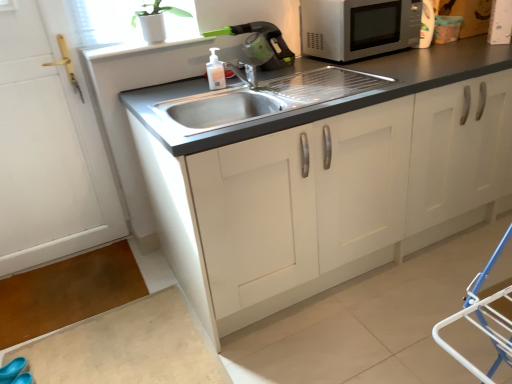
Question: Should I look upward or downward to see stainless steel sink at center?

Choices:
 (A) up
 (B) down

Answer: (A)

Question: Does satin silver microwave at upper right have a lesser width compared to translucent plastic soap dispenser at sink?

Choices:
 (A) no
 (B) yes

Answer: (A)

Question: From the image's perspective, would you say satin silver microwave at upper right is positioned over translucent plastic soap dispenser at sink?

Choices:
 (A) no
 (B) yes

Answer: (B)

Question: Is satin silver microwave at upper right oriented towards translucent plastic soap dispenser at sink?

Choices:
 (A) no
 (B) yes

Answer: (A)

Question: Is satin silver microwave at upper right shorter than translucent plastic soap dispenser at sink?

Choices:
 (A) no
 (B) yes

Answer: (A)

Question: Is satin silver microwave at upper right wider than translucent plastic soap dispenser at sink?

Choices:
 (A) no
 (B) yes

Answer: (B)

Question: From a real-world perspective, is satin silver microwave at upper right located higher than translucent plastic soap dispenser at sink?

Choices:
 (A) no
 (B) yes

Answer: (B)

Question: From the image's perspective, does blue rubber shoe at lower left appear higher than white matte plant pot at upper left?

Choices:
 (A) yes
 (B) no

Answer: (B)

Question: Considering the relative positions of blue rubber shoe at lower left and white matte plant pot at upper left in the image provided, is blue rubber shoe at lower left to the left of white matte plant pot at upper left from the viewer's perspective?

Choices:
 (A) no
 (B) yes

Answer: (B)

Question: Are blue rubber shoe at lower left and white matte plant pot at upper left far apart?

Choices:
 (A) yes
 (B) no

Answer: (A)

Question: Does blue rubber shoe at lower left have a smaller size compared to white matte plant pot at upper left?

Choices:
 (A) no
 (B) yes

Answer: (B)

Question: Considering the relative sizes of blue rubber shoe at lower left and white matte plant pot at upper left in the image provided, is blue rubber shoe at lower left thinner than white matte plant pot at upper left?

Choices:
 (A) yes
 (B) no

Answer: (A)

Question: Is blue rubber shoe at lower left wider than white matte plant pot at upper left?

Choices:
 (A) yes
 (B) no

Answer: (B)

Question: Is satin silver microwave at upper right oriented away from white matte cabinet at center?

Choices:
 (A) yes
 (B) no

Answer: (B)